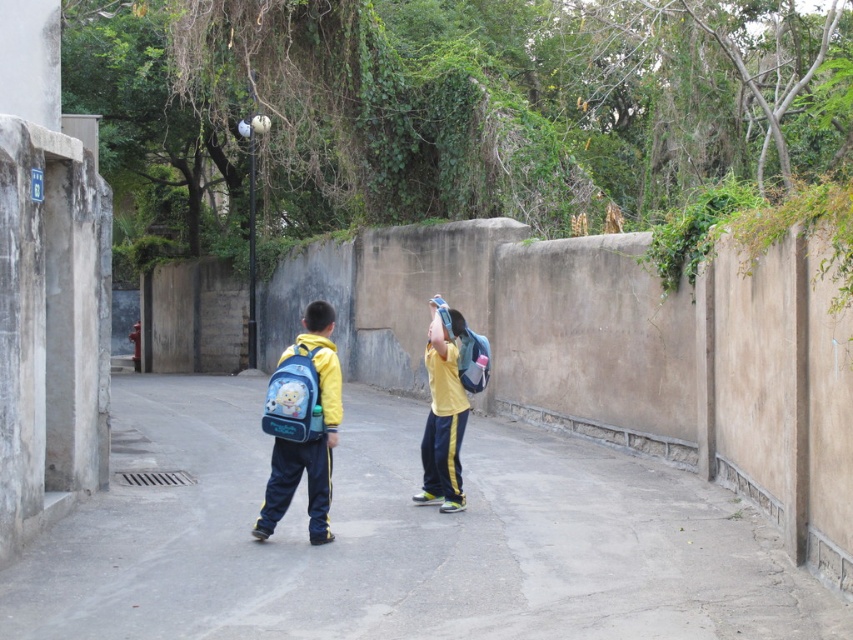
Question: Which point is farther to the camera?

Choices:
 (A) (273, 432)
 (B) (556, 500)

Answer: (B)

Question: Among these objects, which one is farthest from the camera?

Choices:
 (A) yellow matte/synthetic uniform at center
 (B) blue fabric backpack at center
 (C) matte yellow jacket at center

Answer: (A)

Question: Does blue fabric backpack at center have a lesser width compared to yellow matte/synthetic uniform at center?

Choices:
 (A) yes
 (B) no

Answer: (B)

Question: Which of the following is the farthest from the observer?

Choices:
 (A) (440, 403)
 (B) (328, 496)
 (C) (393, 595)

Answer: (A)

Question: Considering the relative positions of matte yellow jacket at center and yellow matte/synthetic uniform at center in the image provided, where is matte yellow jacket at center located with respect to yellow matte/synthetic uniform at center?

Choices:
 (A) below
 (B) above

Answer: (A)

Question: Can you confirm if blue fabric backpack at center is positioned above yellow matte/synthetic uniform at center?

Choices:
 (A) no
 (B) yes

Answer: (A)